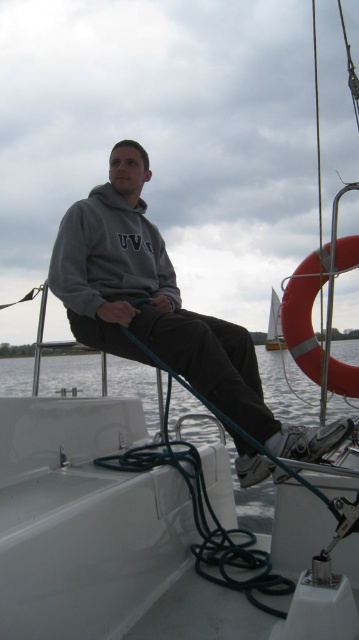
Is point (114, 244) more distant than point (273, 346)?

No, (114, 244) is closer to viewer.

Identify the location of gray fleece sweatshirt at center. (109, 253).

You are a GUI agent. You are given a task and a screenshot of the screen. Output one action in this format:
    pyautogui.click(x=<x>, y=<y>)
    Task: Click on the gray fleece sweatshirt at center
    The height and width of the screenshot is (640, 359).
    Given the screenshot: What is the action you would take?
    pyautogui.click(x=109, y=253)

Between white glossy water at lower center and white fabric sail at center, which one has less height?

Standing shorter between the two is white fabric sail at center.

The image size is (359, 640). Find the location of `white glossy water at lower center`. white glossy water at lower center is located at coordinates (286, 388).

Does point (53, 280) come in front of point (48, 276)?

Yes, it is.

Which is more to the left, gray fleece hoodie at center or gray fleece sweatshirt at center?

gray fleece sweatshirt at center

Locate an element on the screen. gray fleece hoodie at center is located at coordinates (161, 308).